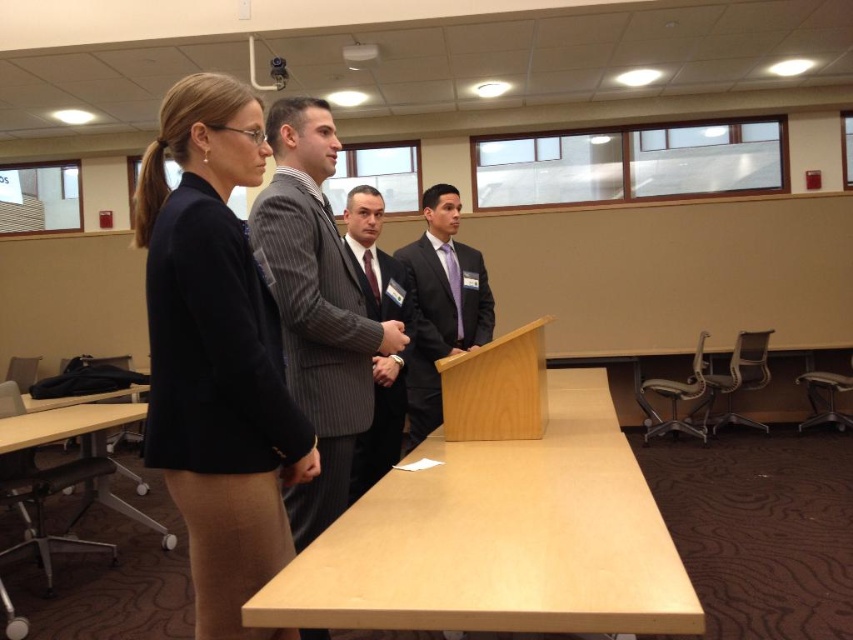
Which is above, light wood podium at center or pinstriped wool suit at center?

pinstriped wool suit at center is higher up.

Who is taller, light wood podium at center or pinstriped wool suit at center?

pinstriped wool suit at center is taller.

Image resolution: width=853 pixels, height=640 pixels. Identify the location of light wood podium at center. (502, 525).

Is point (541, 508) behind point (250, 312)?

Yes, it is.

Between point (509, 445) and point (143, 236), which one is positioned behind?

Positioned behind is point (509, 445).

Who is more forward, (488, 480) or (236, 552)?

Positioned in front is point (236, 552).

Locate an element on the screen. light wood podium at center is located at coordinates (502, 525).

Is light wood podium at center closer to camera compared to dark gray pinstripe suit at center?

That is True.

Which is more to the right, light wood podium at center or dark gray pinstripe suit at center?

light wood podium at center

Locate an element on the screen. The height and width of the screenshot is (640, 853). light wood podium at center is located at coordinates (502, 525).